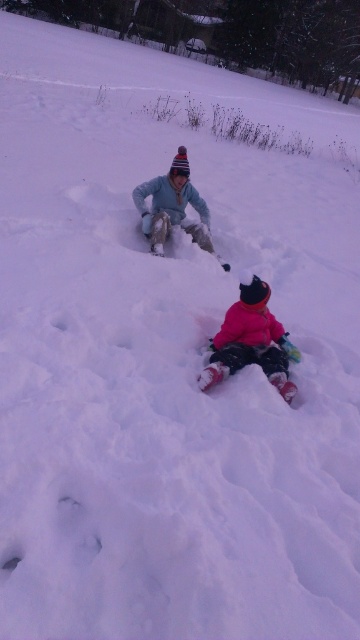
Question: Which point appears closest to the camera in this image?

Choices:
 (A) (244, 340)
 (B) (204, 220)

Answer: (A)

Question: Can you confirm if fluffy pink snowsuit at lower center is smaller than light blue fabric snowsuit at center?

Choices:
 (A) yes
 (B) no

Answer: (A)

Question: Is fluffy pink snowsuit at lower center bigger than light blue fabric snowsuit at center?

Choices:
 (A) no
 (B) yes

Answer: (A)

Question: Is fluffy pink snowsuit at lower center positioned at the back of light blue fabric snowsuit at center?

Choices:
 (A) no
 (B) yes

Answer: (A)

Question: Which object is closer to the camera taking this photo?

Choices:
 (A) fluffy pink snowsuit at lower center
 (B) light blue fabric snowsuit at center

Answer: (A)